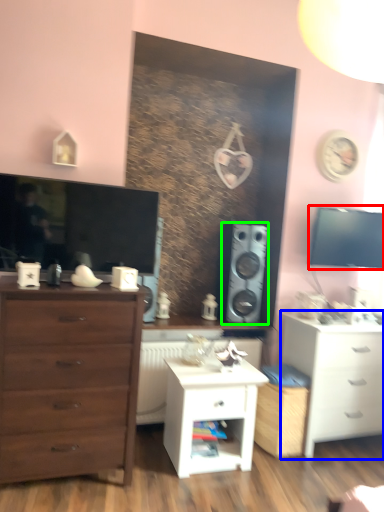
Question: Estimate the real-world distances between objects in this image. Which object is farther from window screen (highlighted by a red box), chest of drawers (highlighted by a blue box) or speaker (highlighted by a green box)?

Choices:
 (A) chest of drawers
 (B) speaker

Answer: (A)